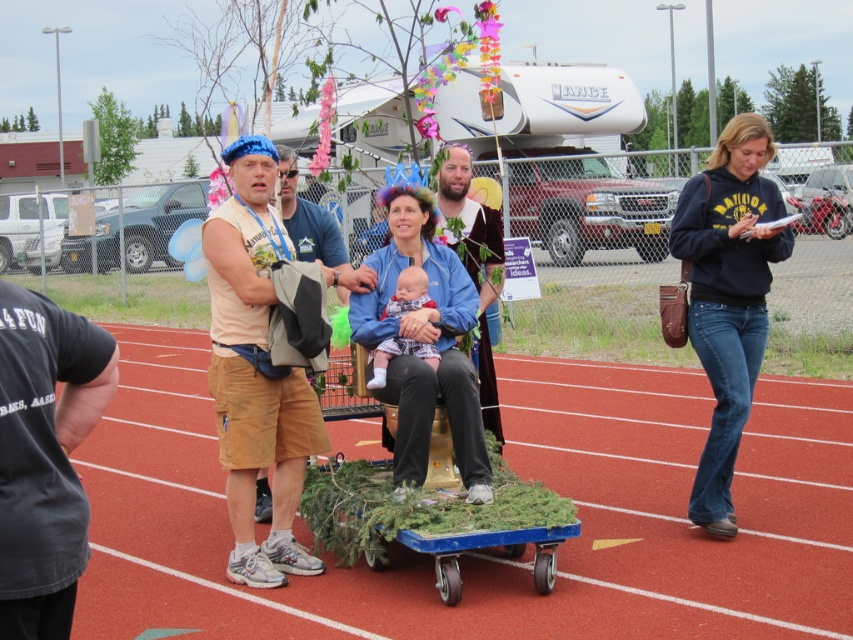
Question: Which of these objects is positioned farthest from the soft white baby at center?

Choices:
 (A) red rubber race track at center
 (B) matte brown cart at center

Answer: (A)

Question: Does red rubber race track at center appear on the right side of blue denim jacket at center?

Choices:
 (A) yes
 (B) no

Answer: (A)

Question: Is dark blue hoodie at center thinner than tan fabric shorts at left?

Choices:
 (A) yes
 (B) no

Answer: (B)

Question: Which point is farther to the camera?

Choices:
 (A) (428, 428)
 (B) (729, 486)

Answer: (B)

Question: Which is farther from the brown leather jacket at center?

Choices:
 (A) tan cargo shorts at center
 (B) tan fabric shorts at left
 (C) blue denim jacket at center

Answer: (A)

Question: Is tan cargo shorts at center wider than brown leather jacket at center?

Choices:
 (A) yes
 (B) no

Answer: (A)